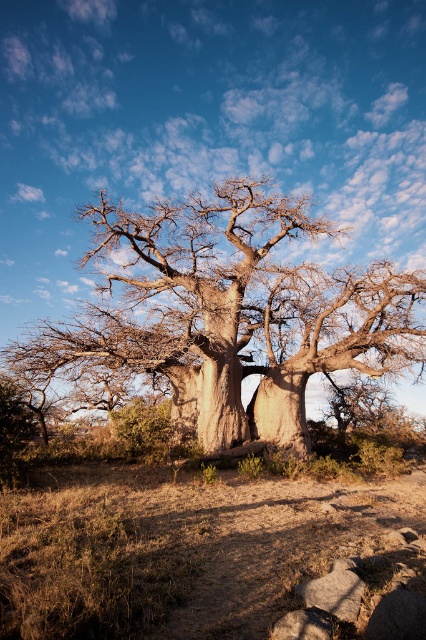
You are a small animal trying to hide from predators. You see the brown dry grass at lower center and the smooth brown tree at center. Which location would provide better concealment based on their heights?

The brown dry grass at lower center has a lesser height compared to the smooth brown tree at center, so it would provide better concealment as it is shorter and less noticeable to predators.

You are standing in front of the baobab tree and notice a specific point marked at coordinates (201, 554). What object is located at that point?

The brown dry grass at lower center is located at point (201, 554).

You are a hiker who wants to place a tent on the ground near the smooth brown tree at center. However, you notice brown dry grass at lower center. Where exactly should you place the tent to avoid the grass?

You should place the tent to the left of the smooth brown tree at center, as the brown dry grass at lower center is located to the right of the tree.